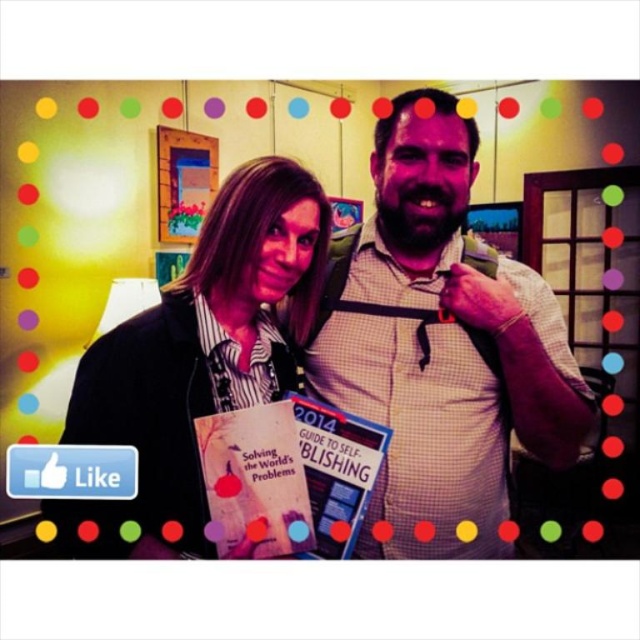
Does white checkered shirt at center lie behind matte black shirt at center?

That is True.

You are a GUI agent. You are given a task and a screenshot of the screen. Output one action in this format:
    pyautogui.click(x=<x>, y=<y>)
    Task: Click on the white checkered shirt at center
    The width and height of the screenshot is (640, 640).
    Given the screenshot: What is the action you would take?
    pyautogui.click(x=440, y=346)